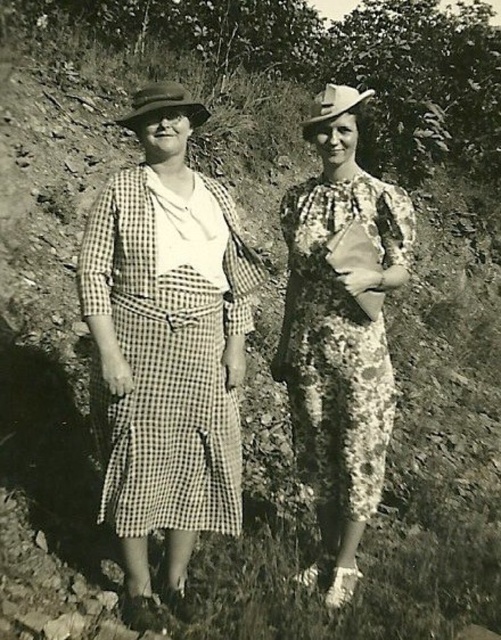
Question: Can you confirm if checkered fabric dress at center is thinner than floral-patterned fabric dress at center?

Choices:
 (A) yes
 (B) no

Answer: (B)

Question: Does checkered fabric dress at center appear under floral-patterned fabric dress at center?

Choices:
 (A) yes
 (B) no

Answer: (A)

Question: Can you confirm if checkered fabric dress at center is positioned below floral-patterned fabric dress at center?

Choices:
 (A) no
 (B) yes

Answer: (B)

Question: Which point appears closest to the camera in this image?

Choices:
 (A) (367, 467)
 (B) (121, 524)

Answer: (B)

Question: Which of the following is the closest to the observer?

Choices:
 (A) checkered fabric dress at center
 (B) floral-patterned fabric dress at center

Answer: (A)

Question: Which object appears farthest from the camera in this image?

Choices:
 (A) floral-patterned fabric dress at center
 (B) checkered fabric dress at center

Answer: (A)